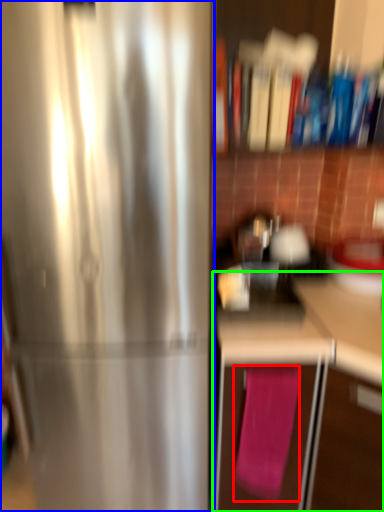
Question: Which is farther away from bath towel (highlighted by a red box)? refrigerator (highlighted by a blue box) or cabinetry (highlighted by a green box)?

Choices:
 (A) refrigerator
 (B) cabinetry

Answer: (A)